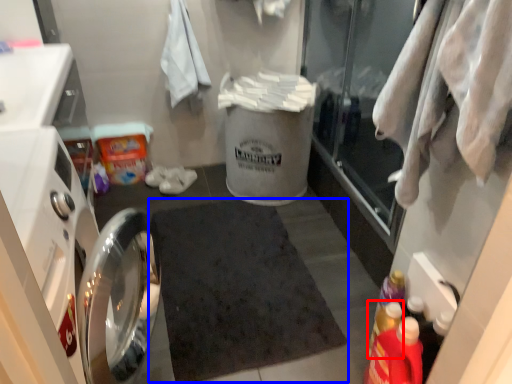
Question: Which object is further to the camera taking this photo, bottle (highlighted by a red box) or bath mat (highlighted by a blue box)?

Choices:
 (A) bottle
 (B) bath mat

Answer: (B)